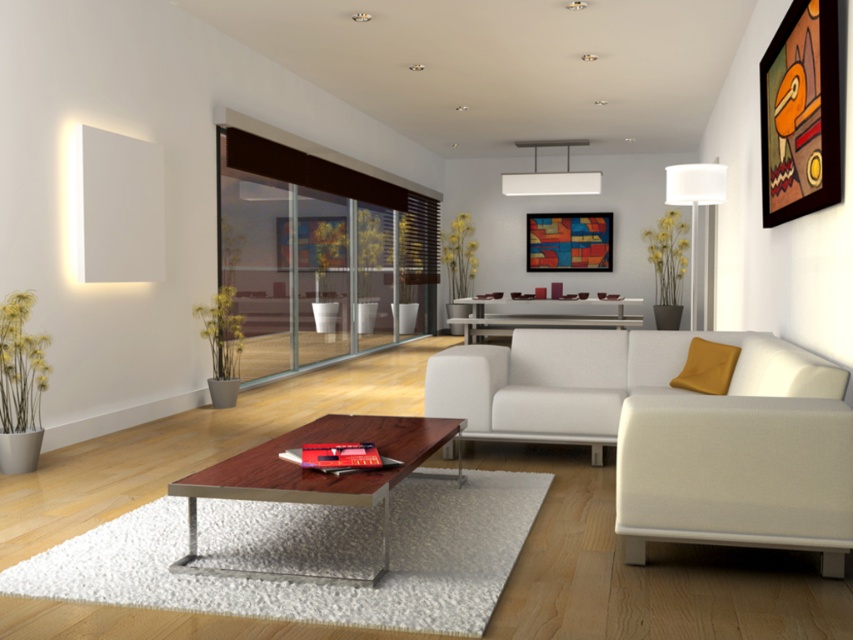
In the scene shown: Can you confirm if white fabric couch at center is positioned to the right of wooden/metal coffee table at center?

Correct, you'll find white fabric couch at center to the right of wooden/metal coffee table at center.

Who is more forward, (537,368) or (393,436)?

Positioned in front is point (393,436).

Between point (764, 358) and point (381, 433), which one is positioned behind?

The point (764, 358) is behind.

Image resolution: width=853 pixels, height=640 pixels. Identify the location of white fabric couch at center. (674, 429).

Does transparent glass door at center appear over wooden framed artwork at upper right?

Yes, transparent glass door at center is above wooden framed artwork at upper right.

What do you see at coordinates (318, 253) in the screenshot? This screenshot has height=640, width=853. I see `transparent glass door at center` at bounding box center [318, 253].

Is point (347, 314) positioned after point (821, 182)?

That is True.

At what (x,y) coordinates should I click in order to perform the action: click on transparent glass door at center. Please return your answer as a coordinate pair (x, y). Looking at the image, I should click on (318, 253).

Is point (840, 467) closer to camera compared to point (610, 316)?

That is True.

Can you confirm if white fabric couch at center is bigger than metallic silver console table at center?

Indeed, white fabric couch at center has a larger size compared to metallic silver console table at center.

Describe the element at coordinates (674, 429) in the screenshot. I see `white fabric couch at center` at that location.

The height and width of the screenshot is (640, 853). Identify the location of white fabric couch at center. (674, 429).